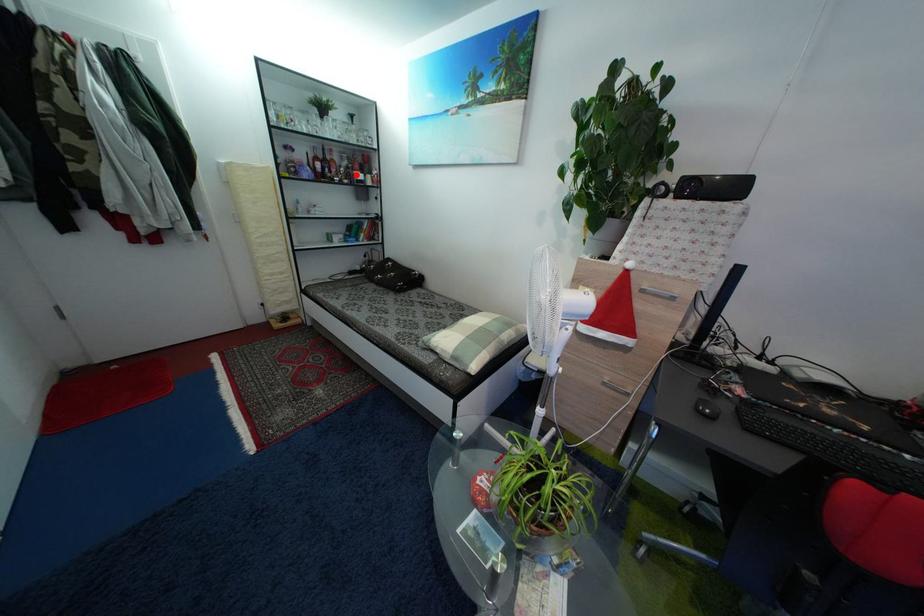
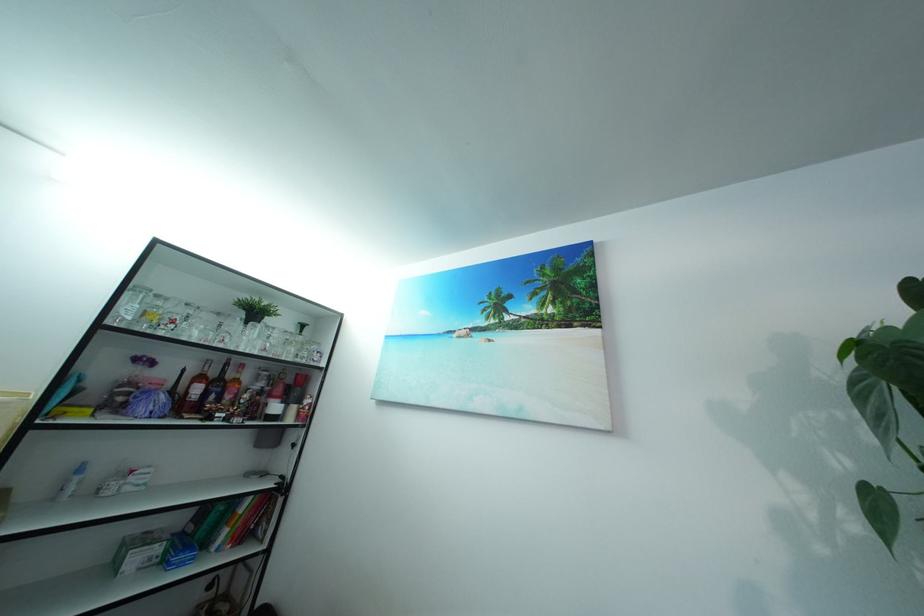
Question: I am providing you with two images of the same scene from different viewpoints. Given a red point in image1, look at the same physical point in image2. Is it:

Choices:
 (A) Closer to the viewpoint
 (B) Farther from the viewpoint

Answer: (B)